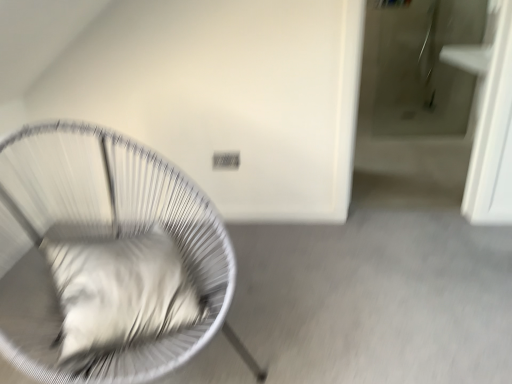
Question: Is white wire chair at left positioned before white soft pillow at left?

Choices:
 (A) yes
 (B) no

Answer: (A)

Question: Is white wire chair at left outside of white soft pillow at left?

Choices:
 (A) no
 (B) yes

Answer: (B)

Question: From the image's perspective, does white wire chair at left appear higher than white soft pillow at left?

Choices:
 (A) no
 (B) yes

Answer: (B)

Question: Is white soft pillow at left located within white wire chair at left?

Choices:
 (A) yes
 (B) no

Answer: (A)

Question: Can you confirm if white wire chair at left is positioned to the right of white soft pillow at left?

Choices:
 (A) yes
 (B) no

Answer: (B)

Question: Can you confirm if white wire chair at left is taller than white soft pillow at left?

Choices:
 (A) yes
 (B) no

Answer: (A)

Question: Does white soft pillow at left have a lesser width compared to white wire chair at left?

Choices:
 (A) no
 (B) yes

Answer: (B)

Question: Considering the relative sizes of white soft pillow at left and white wire chair at left in the image provided, is white soft pillow at left taller than white wire chair at left?

Choices:
 (A) no
 (B) yes

Answer: (A)

Question: Is white soft pillow at left to the left of white wire chair at left from the viewer's perspective?

Choices:
 (A) no
 (B) yes

Answer: (A)

Question: Is white wire chair at left at the back of white soft pillow at left?

Choices:
 (A) no
 (B) yes

Answer: (B)

Question: From the image's perspective, is white soft pillow at left on white wire chair at left?

Choices:
 (A) yes
 (B) no

Answer: (B)

Question: Is white soft pillow at left oriented towards white wire chair at left?

Choices:
 (A) no
 (B) yes

Answer: (B)

Question: Relative to white wire chair at left, is white soft pillow at left in front or behind?

Choices:
 (A) behind
 (B) front

Answer: (A)